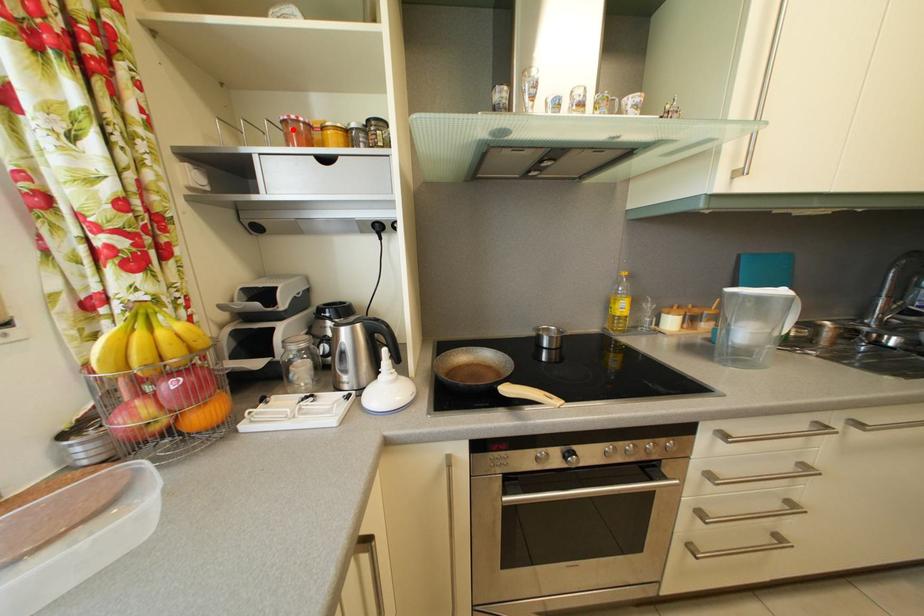
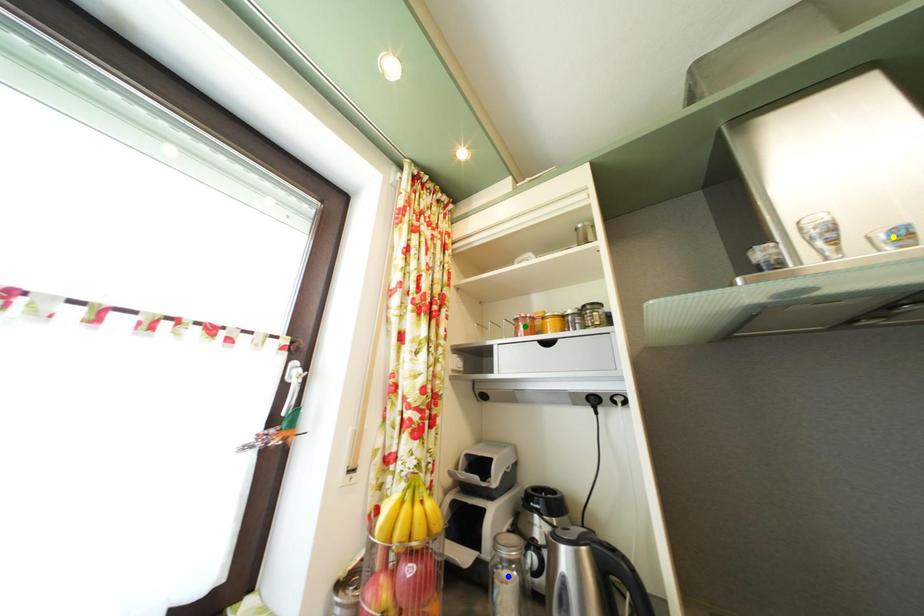
Question: I am providing you with two images of the same scene from different viewpoints. A red point is marked on the first image. You are given multiple points on the second image. Which spot in image 2 lines up with the point in image 1?

Choices:
 (A) yellow point
 (B) green point
 (C) blue point

Answer: (B)